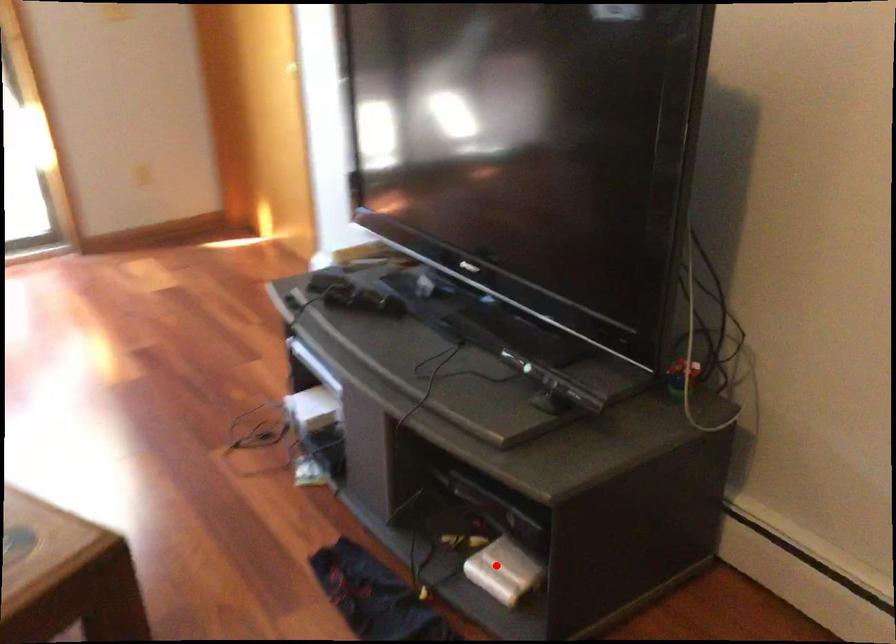
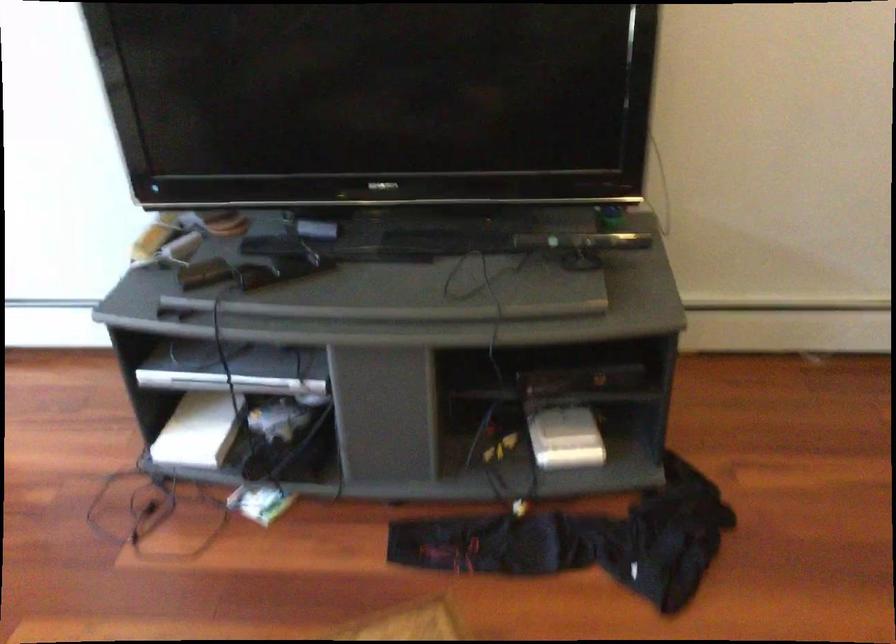
In the second image, find the point that corresponds to the highlighted location in the first image.

(565, 438)